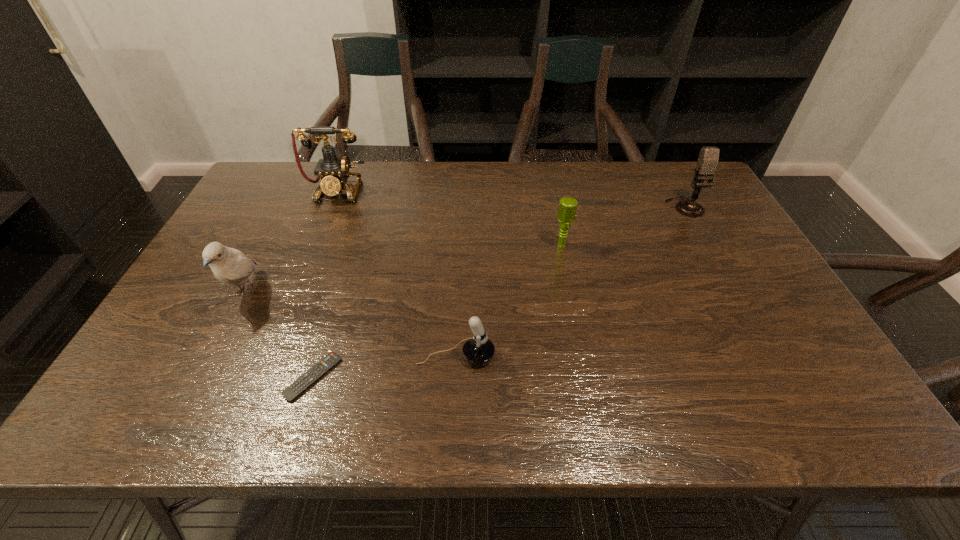
At what (x,y) coordinates should I click in order to perform the action: click on vacant space that's between the telephone and the rightmost object. Please return your answer as a coordinate pair (x, y). Image resolution: width=960 pixels, height=540 pixels. Looking at the image, I should click on (511, 199).

I want to click on free space between the rightmost microphone and the remote control, so click(499, 292).

This screenshot has height=540, width=960. Find the location of `empty space between the bird and the shortest object`. empty space between the bird and the shortest object is located at coordinates (280, 335).

Where is `vacant point located between the nearest microphone and the telephone`? This screenshot has width=960, height=540. vacant point located between the nearest microphone and the telephone is located at coordinates (396, 274).

Image resolution: width=960 pixels, height=540 pixels. Find the location of `free space between the shortest microphone and the second object from right to left`. free space between the shortest microphone and the second object from right to left is located at coordinates (509, 301).

You are a GUI agent. You are given a task and a screenshot of the screen. Output one action in this format:
    pyautogui.click(x=<x>, y=<y>)
    Task: Click on the empty location between the telephone and the tallest microphone
    The image size is (960, 540).
    Given the screenshot: What is the action you would take?
    pyautogui.click(x=511, y=199)

Identify the location of vacant point located between the telephone and the third object from right to left. The height and width of the screenshot is (540, 960). (396, 274).

Image resolution: width=960 pixels, height=540 pixels. I want to click on object that is the second nearest to the second microphone from right to left, so click(478, 350).

Where is `the third closest object to the second farthest microphone`? This screenshot has width=960, height=540. the third closest object to the second farthest microphone is located at coordinates (334, 172).

Find the location of a particular element. Image resolution: width=960 pixels, height=540 pixels. microphone that is the closest to the second shortest object is located at coordinates pos(567,208).